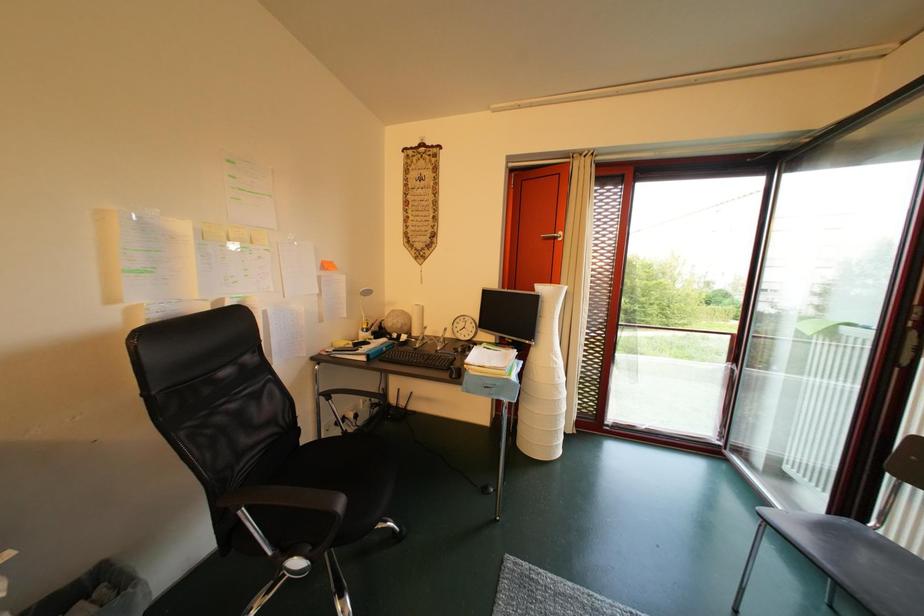
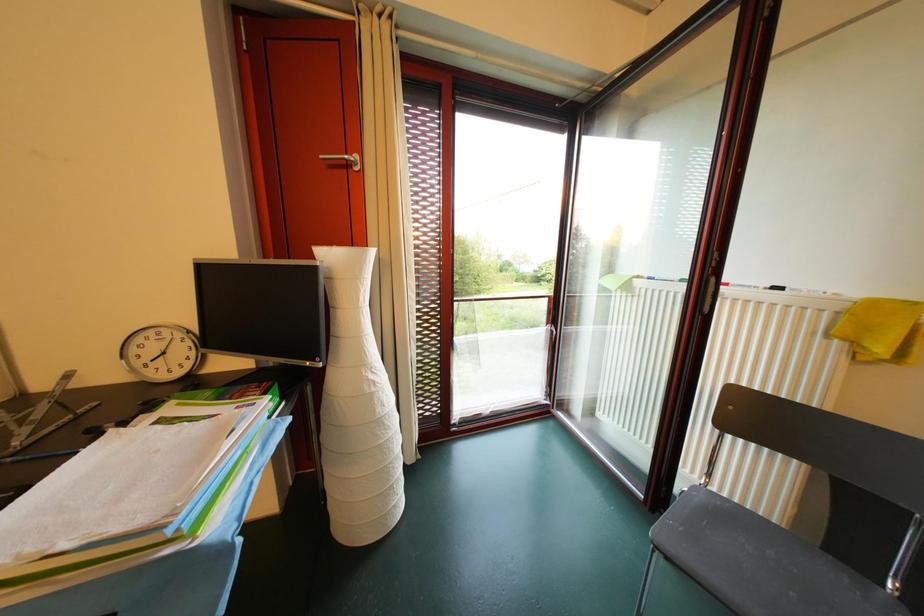
Question: Based on the continuous images, in which direction is the camera rotating? Reply with the corresponding letter.

Choices:
 (A) Left
 (B) Right
 (C) Up
 (D) Down

Answer: (B)